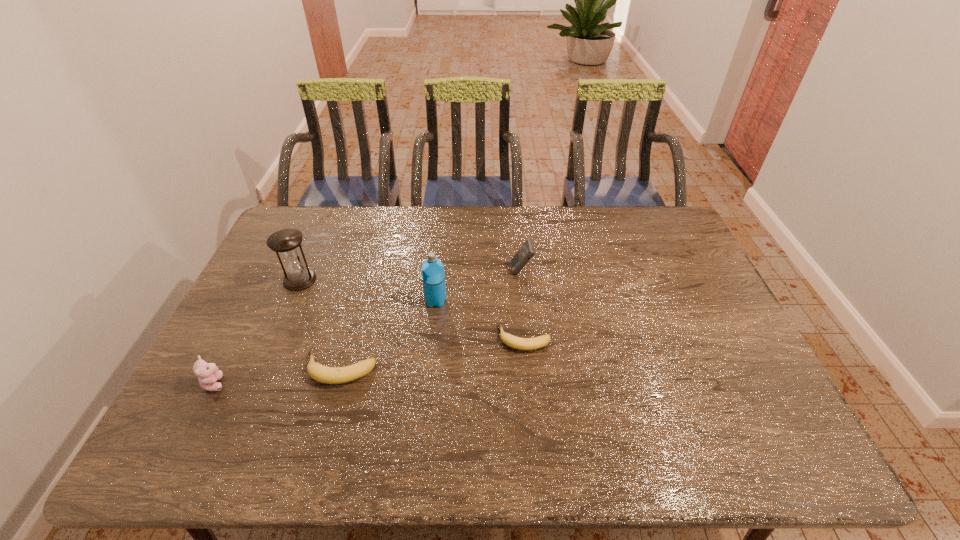
I want to click on free space located on the front of the fourth object from right to left, so click(x=327, y=414).

Identify the location of free space located 0.060m on the left of the right banana. Image resolution: width=960 pixels, height=540 pixels. (476, 339).

Locate an element on the screen. free location located 0.270m on the back of the third farthest object is located at coordinates (442, 239).

This screenshot has height=540, width=960. In order to click on vacant area situated 0.170m on the back of the hourglass in this screenshot , I will do `click(319, 237)`.

I want to click on vacant space located at the face of the teddy bear, so click(281, 383).

Where is `vacant region located on the front-facing side of the calculator`? This screenshot has width=960, height=540. vacant region located on the front-facing side of the calculator is located at coordinates (483, 271).

Locate an element on the screen. This screenshot has width=960, height=540. blank area located on the front-facing side of the calculator is located at coordinates (396, 271).

I want to click on vacant space located 0.290m on the front-facing side of the calculator, so click(x=420, y=271).

The image size is (960, 540). Identify the location of banana that is at the near edge. (329, 375).

You are a GUI agent. You are given a task and a screenshot of the screen. Output one action in this format:
    pyautogui.click(x=<x>, y=<y>)
    Task: Click on the teddy bear located in the near edge section of the desktop
    
    Given the screenshot: What is the action you would take?
    pyautogui.click(x=208, y=373)